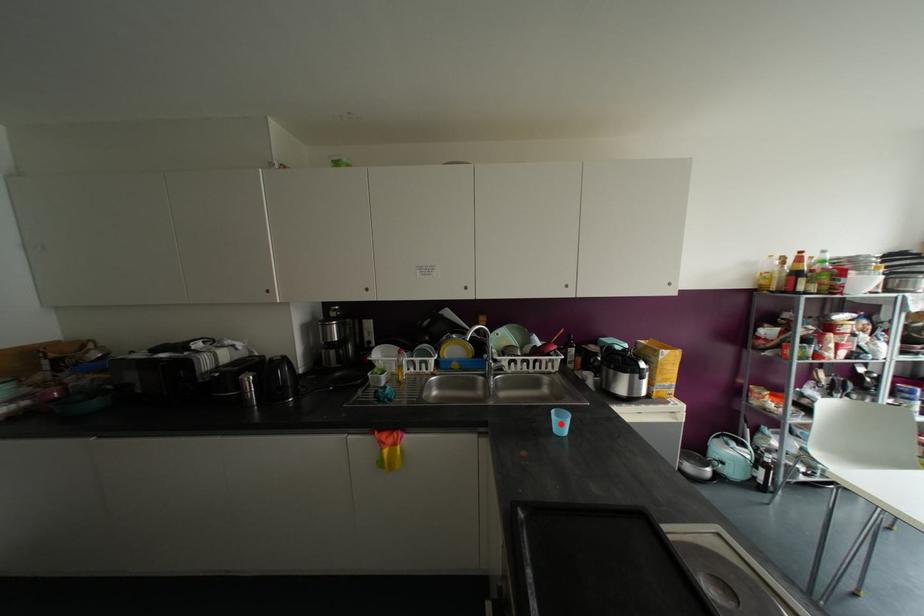
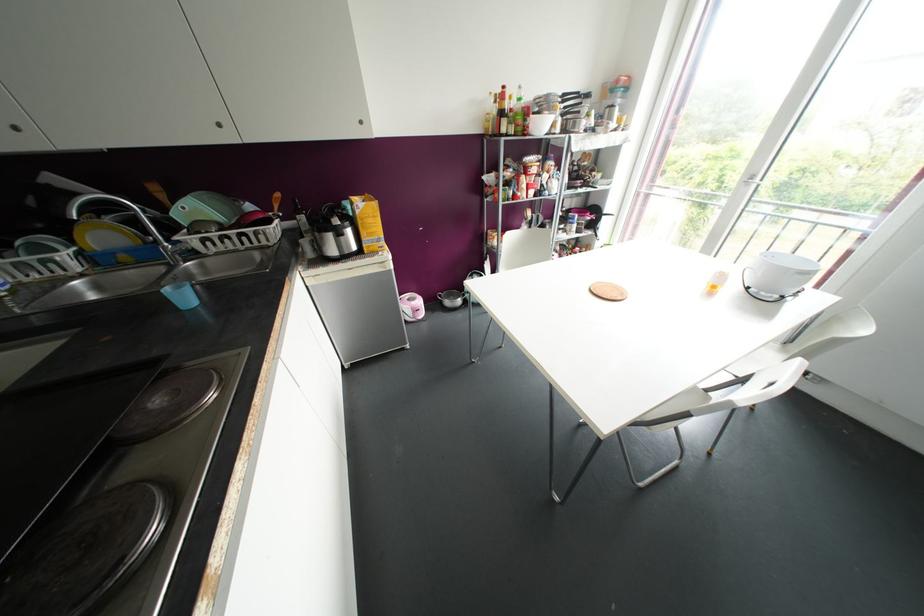
Where in the second image is the point corresponding to the highlighted location from the first image?

(184, 297)